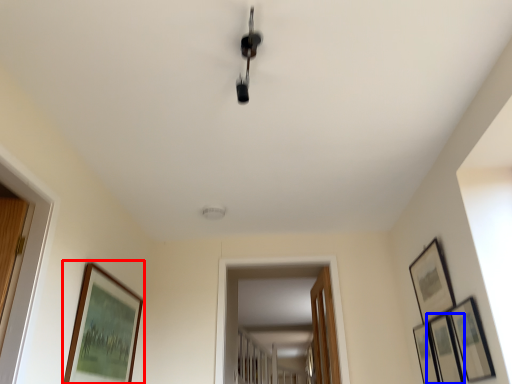
Question: Which object is closer to the camera taking this photo, picture frame (highlighted by a red box) or picture frame (highlighted by a blue box)?

Choices:
 (A) picture frame
 (B) picture frame

Answer: (A)